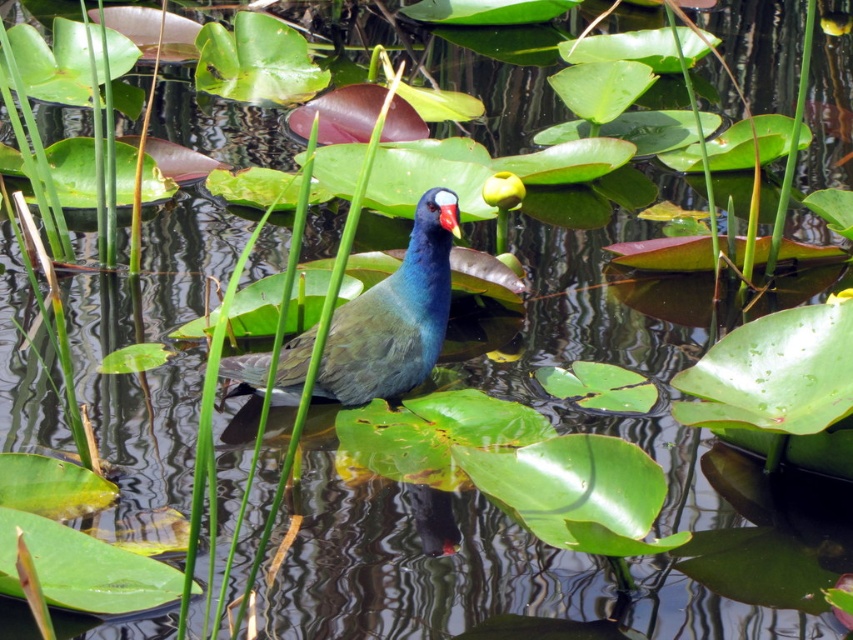
You are a wildlife photographer trying to capture a closeup shot of the purple glossy bird at center and its purple glossy beak at center. Based on the scene, which one is wider?

The purple glossy bird at center is wider than the purple glossy beak at center.

Looking at this image, you are a wildlife photographer aiming to capture a closeup shot of the purple glossy bird at center. Your camera has a maximum zoom range of 3 meters. Can you get a clear closeup without moving closer physically?

The distance between the purple glossy bird at center and the camera is 3.85 meters. Since the camera can only zoom up to 3 meters, you cannot get a clear closeup without moving closer physically.